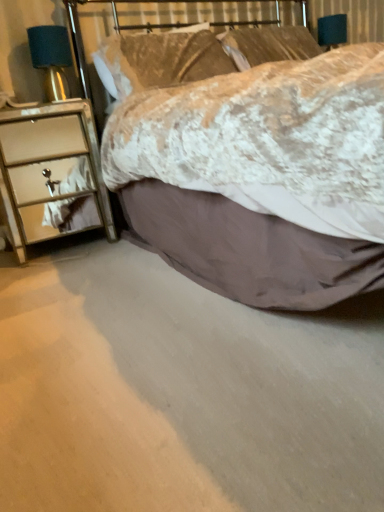
This screenshot has width=384, height=512. In order to click on free space in front of metallic mirrored chest of drawers at left in this screenshot , I will do pyautogui.click(x=59, y=273).